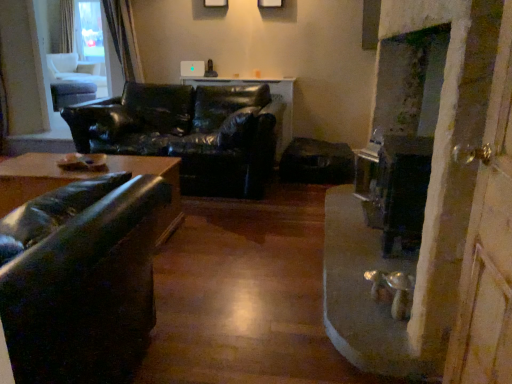
What are the coordinates of `wooden screen door at right` in the screenshot? It's located at (488, 243).

Where is `matte black couch at left, acting as the first studio couch starting from the front`? Image resolution: width=512 pixels, height=384 pixels. matte black couch at left, acting as the first studio couch starting from the front is located at coordinates (81, 280).

Measure the distance between point (79, 82) and camera.

The depth of point (79, 82) is 19.61 feet.

Measure the distance between black leather couch at center, placed as the 1th studio couch when sorted from back to front, and camera.

black leather couch at center, placed as the 1th studio couch when sorted from back to front, and camera are 3.26 meters apart from each other.

Image resolution: width=512 pixels, height=384 pixels. Describe the element at coordinates (188, 133) in the screenshot. I see `black leather couch at center, the 2th studio couch when ordered from front to back` at that location.

Where is `wooden screen door at right`? wooden screen door at right is located at coordinates (488, 243).

Does black leather couch at center, placed as the 1th studio couch when sorted from back to front, have a greater height compared to matte black couch at left, acting as the first studio couch starting from the front?

In fact, black leather couch at center, placed as the 1th studio couch when sorted from back to front, may be shorter than matte black couch at left, acting as the first studio couch starting from the front.

Considering the positions of objects black leather couch at center, the 2th studio couch when ordered from front to back, and matte black couch at left, acting as the first studio couch starting from the front, in the image provided, who is in front, black leather couch at center, the 2th studio couch when ordered from front to back, or matte black couch at left, acting as the first studio couch starting from the front,?

matte black couch at left, acting as the first studio couch starting from the front, is more forward.

Is black leather couch at center, placed as the 1th studio couch when sorted from back to front, oriented away from matte black couch at left, acting as the first studio couch starting from the front?

No, matte black couch at left, acting as the first studio couch starting from the front, is not at the back of black leather couch at center, placed as the 1th studio couch when sorted from back to front.

Does point (113, 198) come farther from viewer compared to point (232, 118)?

That is False.

Is matte black couch at left, arranged as the second studio couch when viewed from the back, closer to camera compared to black leather couch at center, placed as the 1th studio couch when sorted from back to front?

That is True.

Where is `studio couch below the matte black couch at left, acting as the first studio couch starting from the front (from a real-world perspective)`? studio couch below the matte black couch at left, acting as the first studio couch starting from the front (from a real-world perspective) is located at coordinates (188, 133).

Which is more to the left, matte black couch at left, acting as the first studio couch starting from the front, or black leather couch at center, the 2th studio couch when ordered from front to back?

matte black couch at left, acting as the first studio couch starting from the front.

Based on their sizes in the image, would you say wooden screen door at right is bigger or smaller than matte black coffee table at center?

wooden screen door at right is smaller than matte black coffee table at center.

Is the surface of wooden screen door at right in direct contact with matte black coffee table at center?

No, wooden screen door at right is not making contact with matte black coffee table at center.

Is point (507, 86) positioned in front of point (56, 108)?

Yes, it is in front of point (56, 108).

Is wooden screen door at right shorter than matte black coffee table at center?

In fact, wooden screen door at right may be taller than matte black coffee table at center.

Considering the sizes of objects matte black coffee table at center and black leather couch at center, placed as the 1th studio couch when sorted from back to front, in the image provided, who is bigger, matte black coffee table at center or black leather couch at center, placed as the 1th studio couch when sorted from back to front,?

black leather couch at center, placed as the 1th studio couch when sorted from back to front, is bigger.

How much distance is there between matte black coffee table at center and black leather couch at center, the 2th studio couch when ordered from front to back?

matte black coffee table at center is 2.66 meters away from black leather couch at center, the 2th studio couch when ordered from front to back.

Could you tell me if matte black coffee table at center is turned towards black leather couch at center, placed as the 1th studio couch when sorted from back to front?

Yes, matte black coffee table at center is facing black leather couch at center, placed as the 1th studio couch when sorted from back to front.

Image resolution: width=512 pixels, height=384 pixels. Find the location of `table on the left of black leather couch at center, placed as the 1th studio couch when sorted from back to front`. table on the left of black leather couch at center, placed as the 1th studio couch when sorted from back to front is located at coordinates (71, 93).

From a real-world perspective, is black leather couch at center, placed as the 1th studio couch when sorted from back to front, positioned above or below matte black coffee table at center?

black leather couch at center, placed as the 1th studio couch when sorted from back to front, is situated lower than matte black coffee table at center in the real world.

Between black leather couch at center, placed as the 1th studio couch when sorted from back to front, and matte black coffee table at center, which one has more height?

Standing taller between the two is black leather couch at center, placed as the 1th studio couch when sorted from back to front.

Considering the relative positions of black leather couch at center, the 2th studio couch when ordered from front to back, and matte black coffee table at center in the image provided, is black leather couch at center, the 2th studio couch when ordered from front to back, to the left of matte black coffee table at center from the viewer's perspective?

No, black leather couch at center, the 2th studio couch when ordered from front to back, is not to the left of matte black coffee table at center.

Is black leather couch at center, placed as the 1th studio couch when sorted from back to front, oriented towards matte black coffee table at center?

No, black leather couch at center, placed as the 1th studio couch when sorted from back to front, is not oriented towards matte black coffee table at center.

Could you tell me if matte black couch at left, acting as the first studio couch starting from the front, is turned towards wooden screen door at right?

No, matte black couch at left, acting as the first studio couch starting from the front, is not oriented towards wooden screen door at right.

Between matte black couch at left, acting as the first studio couch starting from the front, and wooden screen door at right, which one is positioned behind?

matte black couch at left, acting as the first studio couch starting from the front.

Is matte black couch at left, acting as the first studio couch starting from the front, positioned beyond the bounds of wooden screen door at right?

matte black couch at left, acting as the first studio couch starting from the front, lies outside wooden screen door at right's area.

Are matte black couch at left, arranged as the second studio couch when viewed from the back, and wooden screen door at right beside each other?

No.

Is wooden screen door at right at the back of black leather couch at center, placed as the 1th studio couch when sorted from back to front?

No.

Which is more to the left, black leather couch at center, placed as the 1th studio couch when sorted from back to front, or wooden screen door at right?

From the viewer's perspective, black leather couch at center, placed as the 1th studio couch when sorted from back to front, appears more on the left side.

In the image, is black leather couch at center, placed as the 1th studio couch when sorted from back to front, positioned in front of or behind wooden screen door at right?

black leather couch at center, placed as the 1th studio couch when sorted from back to front, is positioned farther from the viewer than wooden screen door at right.

Considering the relative sizes of black leather couch at center, the 2th studio couch when ordered from front to back, and wooden screen door at right in the image provided, is black leather couch at center, the 2th studio couch when ordered from front to back, smaller than wooden screen door at right?

Actually, black leather couch at center, the 2th studio couch when ordered from front to back, might be larger than wooden screen door at right.

Identify the location of studio couch on the left of the black leather couch at center, placed as the 1th studio couch when sorted from back to front. The height and width of the screenshot is (384, 512). (81, 280).

Locate an element on the screen. The height and width of the screenshot is (384, 512). studio couch below the black leather couch at center, the 2th studio couch when ordered from front to back (from the image's perspective) is located at coordinates (x=81, y=280).

When comparing their distances from wooden screen door at right, does matte black coffee table at center or matte black couch at left, acting as the first studio couch starting from the front, seem closer?

matte black couch at left, acting as the first studio couch starting from the front.

From the image, which object appears to be farther from black leather couch at center, the 2th studio couch when ordered from front to back, matte black coffee table at center or wooden screen door at right?

The object further to black leather couch at center, the 2th studio couch when ordered from front to back, is wooden screen door at right.

Looking at the image, which one is located closer to black leather couch at center, the 2th studio couch when ordered from front to back, wooden screen door at right or matte black coffee table at center?

Based on the image, matte black coffee table at center appears to be nearer to black leather couch at center, the 2th studio couch when ordered from front to back.

Looking at the image, which one is located further to wooden screen door at right, black leather couch at center, the 2th studio couch when ordered from front to back, or matte black coffee table at center?

matte black coffee table at center.

Looking at the image, which one is located closer to wooden screen door at right, black leather couch at center, the 2th studio couch when ordered from front to back, or matte black couch at left, arranged as the second studio couch when viewed from the back?

Based on the image, matte black couch at left, arranged as the second studio couch when viewed from the back, appears to be nearer to wooden screen door at right.

Looking at this image, which object lies nearer to the anchor point wooden screen door at right, matte black couch at left, acting as the first studio couch starting from the front, or matte black coffee table at center?

Based on the image, matte black couch at left, acting as the first studio couch starting from the front, appears to be nearer to wooden screen door at right.

From the image, which object appears to be farther from black leather couch at center, placed as the 1th studio couch when sorted from back to front, matte black couch at left, arranged as the second studio couch when viewed from the back, or wooden screen door at right?

wooden screen door at right is positioned further to the anchor black leather couch at center, placed as the 1th studio couch when sorted from back to front.

Consider the image. Estimate the real-world distances between objects in this image. Which object is closer to matte black couch at left, acting as the first studio couch starting from the front, wooden screen door at right or matte black coffee table at center?

Among the two, wooden screen door at right is located nearer to matte black couch at left, acting as the first studio couch starting from the front.

At what (x,y) coordinates should I click in order to perform the action: click on studio couch between wooden screen door at right and black leather couch at center, placed as the 1th studio couch when sorted from back to front, in the front-back direction. Please return your answer as a coordinate pair (x, y). The image size is (512, 384). Looking at the image, I should click on (81, 280).

Locate an element on the screen. studio couch between matte black couch at left, acting as the first studio couch starting from the front, and matte black coffee table at center from front to back is located at coordinates (188, 133).